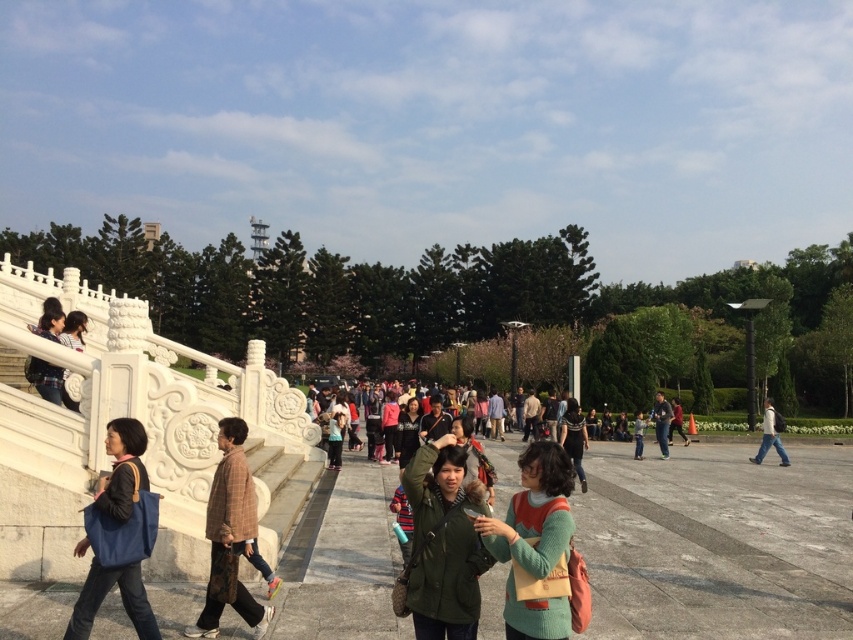
Question: Can you confirm if green knitted sweater at center is positioned to the left of matte black jacket at upper left?

Choices:
 (A) no
 (B) yes

Answer: (A)

Question: Which object appears closest to the camera in this image?

Choices:
 (A) matte blue bag at lower left
 (B) white matte jacket at center-right
 (C) green matte jacket at center
 (D) dark brown leather jacket at center

Answer: (C)

Question: Which is farther from the matte blue bag at lower left?

Choices:
 (A) green knitted sweater at center
 (B) green fabric jacket at center

Answer: (B)

Question: Can you confirm if matte blue bag at lower left is bigger than white matte jacket at center-right?

Choices:
 (A) no
 (B) yes

Answer: (A)

Question: Among these points, which one is nearest to the camera?

Choices:
 (A) [640, 458]
 (B) [666, 420]
 (C) [479, 502]

Answer: (C)

Question: Can you confirm if green knitted sweater at center is bigger than matte black jacket at upper left?

Choices:
 (A) yes
 (B) no

Answer: (A)